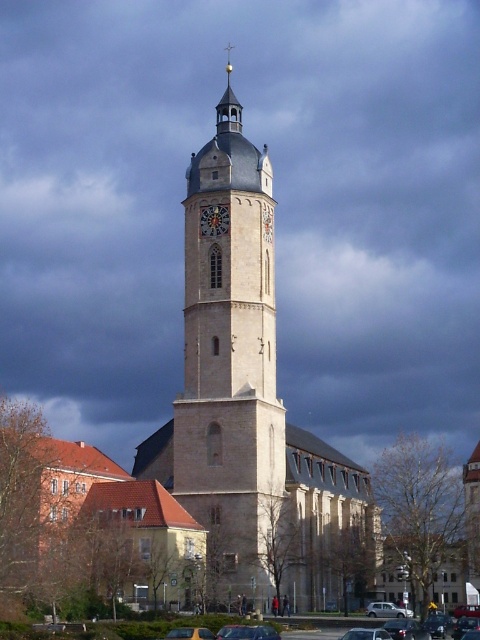
Between point (400, 621) and point (471, 612), which one is positioned in front?

Point (400, 621)

This screenshot has width=480, height=640. Describe the element at coordinates (406, 628) in the screenshot. I see `metallic silver car at center` at that location.

Locate an element on the screen. The image size is (480, 640). metallic silver car at center is located at coordinates (406, 628).

From the picture: Is metallic silver car at center closer to camera compared to silver metallic car at lower center?

Yes, it is.

Locate an element on the screen. The image size is (480, 640). metallic silver car at center is located at coordinates (406, 628).

What are the coordinates of `metallic silver car at center` in the screenshot? It's located at (406, 628).

Does beige stone tower at center have a larger size compared to metallic red car at center?

Yes.

Between beige stone tower at center and metallic red car at center, which one has less height?

metallic red car at center

Measure the distance between point (216, 269) and camera.

81.52 meters

Where is `beige stone tower at center`? The height and width of the screenshot is (640, 480). beige stone tower at center is located at coordinates (230, 368).